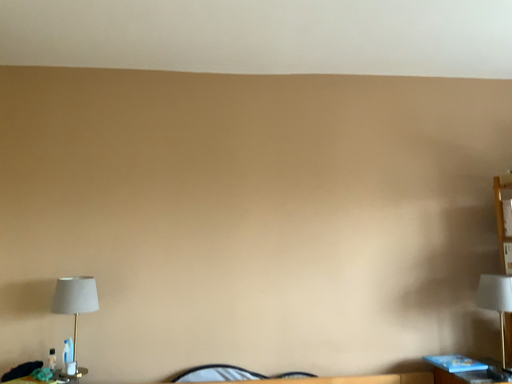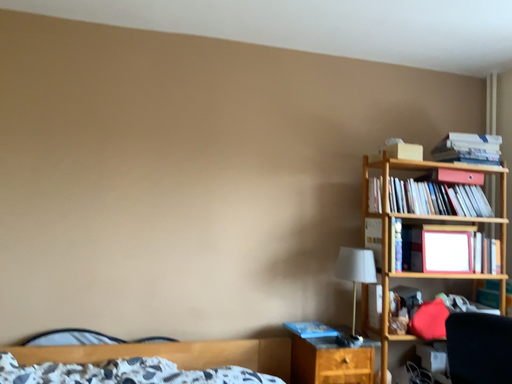
Question: How did the camera likely rotate when shooting the video?

Choices:
 (A) rotated left
 (B) rotated right

Answer: (B)